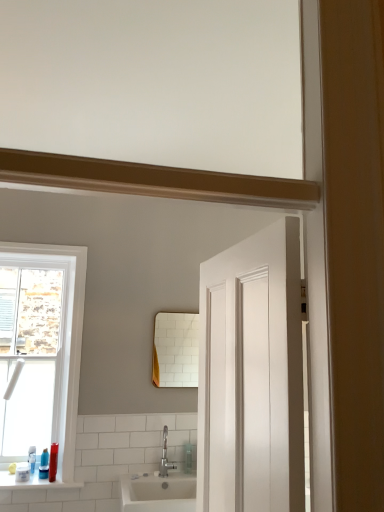
What is the approximate width of white glossy window at left?

The width of white glossy window at left is 1.95 inches.

Identify the location of silver metallic faucet at lower center. This screenshot has height=512, width=384. (165, 456).

Locate an element on the screen. The width and height of the screenshot is (384, 512). translucent plastic bottle at lower left, which ranks as the first toiletry in right-to-left order is located at coordinates (53, 462).

Find the location of a particular element. white glossy window at left is located at coordinates click(x=62, y=334).

Considering the relative positions of silver metallic faucet at lower center and translucent plastic soap at lower left, which ranks as the second toiletry in right-to-left order, in the image provided, is silver metallic faucet at lower center to the right of translucent plastic soap at lower left, which ranks as the second toiletry in right-to-left order, from the viewer's perspective?

Yes.

Is silver metallic faucet at lower center positioned behind translucent plastic soap at lower left, which appears as the first toiletry when viewed from the left?

Yes, it is.

Could you measure the distance between clear plastic soap dispenser at center and white glossy window sill at lower left?

clear plastic soap dispenser at center and white glossy window sill at lower left are 34.19 inches apart from each other.

Based on the photo, considering the sizes of clear plastic soap dispenser at center and white glossy window sill at lower left in the image, is clear plastic soap dispenser at center wider or thinner than white glossy window sill at lower left?

clear plastic soap dispenser at center is thinner than white glossy window sill at lower left.

Where is `soap dispenser lying above the white glossy window sill at lower left (from the image's perspective)`? soap dispenser lying above the white glossy window sill at lower left (from the image's perspective) is located at coordinates (188, 458).

Which is behind, point (184, 467) or point (5, 485)?

The point (184, 467) is behind.

Is silver metallic faucet at lower center far from white glossy window sill at lower left?

No, silver metallic faucet at lower center is in close proximity to white glossy window sill at lower left.

Which is nearer, [175,465] or [56,485]?

The point [56,485] is more forward.

What's the angular difference between silver metallic faucet at lower center and white glossy window sill at lower left's facing directions?

The facing directions of silver metallic faucet at lower center and white glossy window sill at lower left are 0.476 degrees apart.

Is silver metallic faucet at lower center oriented away from white glossy window sill at lower left?

No, silver metallic faucet at lower center is not facing away from white glossy window sill at lower left.

Between translucent plastic soap at lower left, which appears as the first toiletry when viewed from the left, and translucent plastic bottle at lower left, which ranks as the first toiletry in right-to-left order, which one has smaller size?

translucent plastic soap at lower left, which appears as the first toiletry when viewed from the left.

Is point (29, 473) closer to camera compared to point (49, 478)?

That is False.

Is translucent plastic soap at lower left, which ranks as the second toiletry in right-to-left order, aimed at translucent plastic bottle at lower left, the 2th toiletry positioned from the left?

No, translucent plastic soap at lower left, which ranks as the second toiletry in right-to-left order, is not oriented towards translucent plastic bottle at lower left, the 2th toiletry positioned from the left.

Is translucent plastic bottle at lower left, the 2th toiletry positioned from the left, surrounded by translucent plastic soap at lower left, which appears as the first toiletry when viewed from the left?

No, translucent plastic bottle at lower left, the 2th toiletry positioned from the left, is located outside of translucent plastic soap at lower left, which appears as the first toiletry when viewed from the left.

In the scene shown: From a real-world perspective, is translucent plastic soap at lower left, which appears as the first toiletry when viewed from the left, above or below silver metallic faucet at lower center?

In terms of real-world spatial position, translucent plastic soap at lower left, which appears as the first toiletry when viewed from the left, is below silver metallic faucet at lower center.

How distant is translucent plastic soap at lower left, which ranks as the second toiletry in right-to-left order, from silver metallic faucet at lower center?

33.60 inches.

Which is in front, point (28, 466) or point (174, 465)?

Point (28, 466)

Which is more to the left, translucent plastic soap at lower left, which ranks as the second toiletry in right-to-left order, or silver metallic faucet at lower center?

From the viewer's perspective, translucent plastic soap at lower left, which ranks as the second toiletry in right-to-left order, appears more on the left side.

Would you say white glossy window at left is outside white glossy window sill at lower left?

Yes, white glossy window at left is outside of white glossy window sill at lower left.

Considering the sizes of objects white glossy window at left and white glossy window sill at lower left in the image provided, who is bigger, white glossy window at left or white glossy window sill at lower left?

white glossy window at left.

Which is in front, point (75, 334) or point (36, 486)?

The point (36, 486) is closer to the camera.

How different are the orientations of white glossy window at left and white glossy window sill at lower left in degrees?

white glossy window at left and white glossy window sill at lower left are facing 0.0756 degrees away from each other.

Between white glossy window at left and translucent plastic bottle at lower left, which ranks as the first toiletry in right-to-left order, which one is positioned behind?

translucent plastic bottle at lower left, which ranks as the first toiletry in right-to-left order.

Could you tell me if white glossy window at left is facing translucent plastic bottle at lower left, the 2th toiletry positioned from the left?

Yes, white glossy window at left is turned towards translucent plastic bottle at lower left, the 2th toiletry positioned from the left.

Identify the location of window in front of the translucent plastic bottle at lower left, which ranks as the first toiletry in right-to-left order. (62, 334).

Is white glossy window at left not close to translucent plastic bottle at lower left, which ranks as the first toiletry in right-to-left order?

white glossy window at left is actually quite close to translucent plastic bottle at lower left, which ranks as the first toiletry in right-to-left order.

Locate an element on the screen. The height and width of the screenshot is (512, 384). tap above the translucent plastic soap at lower left, which appears as the first toiletry when viewed from the left (from the image's perspective) is located at coordinates (165, 456).

Find the location of `soap dispenser behind the white glossy window sill at lower left`. soap dispenser behind the white glossy window sill at lower left is located at coordinates (188, 458).

Looking at the image, which one is located further to white glossy window sill at lower left, translucent plastic bottle at lower left, which ranks as the first toiletry in right-to-left order, or translucent plastic soap at lower left, which ranks as the second toiletry in right-to-left order?

Based on the image, translucent plastic bottle at lower left, which ranks as the first toiletry in right-to-left order, appears to be further to white glossy window sill at lower left.

Which object lies further to the anchor point clear plastic soap dispenser at center, silver metallic faucet at lower center or white glossy window at left?

white glossy window at left.

Considering their positions, is silver metallic faucet at lower center positioned further to translucent plastic soap at lower left, which ranks as the second toiletry in right-to-left order, than white glossy window sill at lower left?

silver metallic faucet at lower center is positioned further to the anchor translucent plastic soap at lower left, which ranks as the second toiletry in right-to-left order.

From the image, which object appears to be nearer to white glossy window sill at lower left, silver metallic faucet at lower center or translucent plastic soap at lower left, which ranks as the second toiletry in right-to-left order?

translucent plastic soap at lower left, which ranks as the second toiletry in right-to-left order.

From the image, which object appears to be nearer to white glossy window sill at lower left, white glossy window at left or silver metallic faucet at lower center?

white glossy window at left lies closer to white glossy window sill at lower left than the other object.

Considering their positions, is white glossy window at left positioned further to silver metallic faucet at lower center than white glossy window sill at lower left?

Based on the image, white glossy window at left appears to be further to silver metallic faucet at lower center.

From the picture: Considering their positions, is translucent plastic bottle at lower left, the 2th toiletry positioned from the left, positioned further to translucent plastic soap at lower left, which appears as the first toiletry when viewed from the left, than clear plastic soap dispenser at center?

clear plastic soap dispenser at center is further to translucent plastic soap at lower left, which appears as the first toiletry when viewed from the left.

Which object lies further to the anchor point white glossy window sill at lower left, translucent plastic bottle at lower left, the 2th toiletry positioned from the left, or clear plastic soap dispenser at center?

Based on the image, clear plastic soap dispenser at center appears to be further to white glossy window sill at lower left.

Where is `window sill between translucent plastic soap at lower left, which appears as the first toiletry when viewed from the left, and silver metallic faucet at lower center from left to right`? The height and width of the screenshot is (512, 384). window sill between translucent plastic soap at lower left, which appears as the first toiletry when viewed from the left, and silver metallic faucet at lower center from left to right is located at coordinates (34, 482).

In order to click on window located between white glossy window sill at lower left and clear plastic soap dispenser at center in the left-right direction in this screenshot , I will do `click(62, 334)`.

The height and width of the screenshot is (512, 384). What are the coordinates of `tap situated between white glossy window at left and clear plastic soap dispenser at center from left to right` in the screenshot? It's located at (165, 456).

The height and width of the screenshot is (512, 384). Find the location of `toiletry located between white glossy window sill at lower left and clear plastic soap dispenser at center in the left-right direction`. toiletry located between white glossy window sill at lower left and clear plastic soap dispenser at center in the left-right direction is located at coordinates (53, 462).